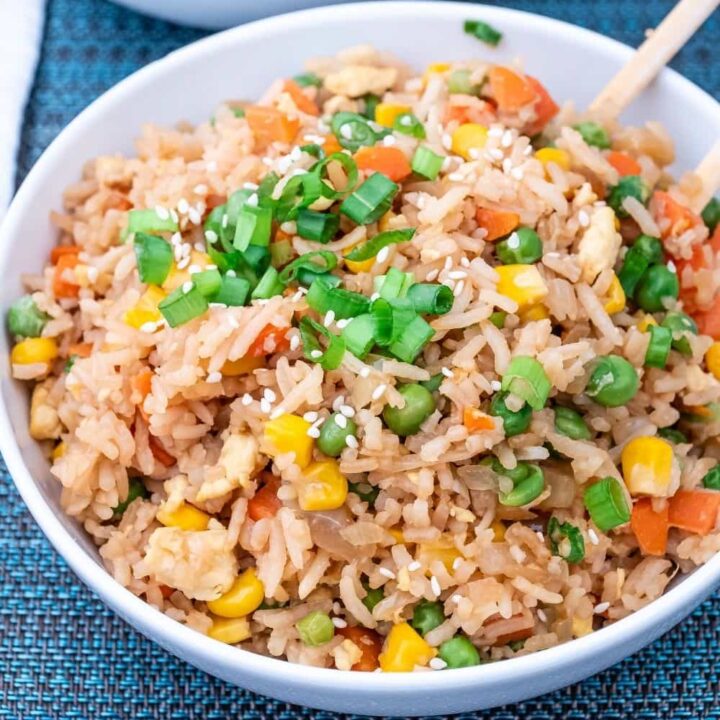
Where is `chopsticks`? This screenshot has height=720, width=720. chopsticks is located at coordinates (706, 170), (657, 58).